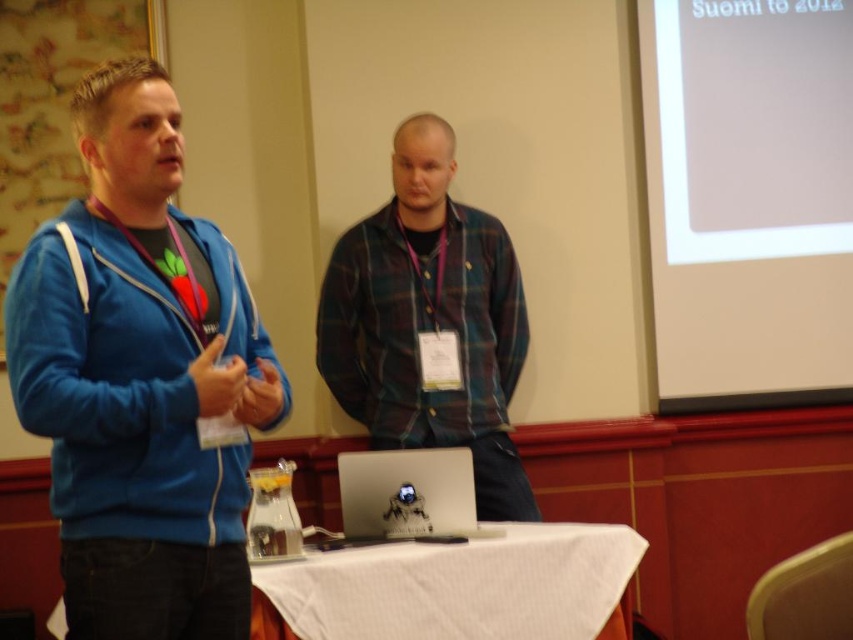
Question: Is plaid fabric shirt at center to the right of white cloth at lower center from the viewer's perspective?

Choices:
 (A) no
 (B) yes

Answer: (A)

Question: Which point is farther to the camera?

Choices:
 (A) white matte projection screen at upper right
 (B) white cloth at lower center
 (C) plaid fabric shirt at center
 (D) blue fleece jacket at left

Answer: (A)

Question: Which of these objects is positioned closest to the white matte projection screen at upper right?

Choices:
 (A) blue fleece jacket at left
 (B) white cloth at lower center
 (C) silver metallic laptop at center
 (D) plaid fabric shirt at center

Answer: (D)

Question: Can you confirm if white matte projection screen at upper right is positioned above plaid fabric shirt at center?

Choices:
 (A) no
 (B) yes

Answer: (B)

Question: Considering the real-world distances, which object is farthest from the white cloth at lower center?

Choices:
 (A) plaid fabric shirt at center
 (B) white matte projection screen at upper right

Answer: (B)

Question: Is plaid fabric shirt at center wider than silver metallic laptop at center?

Choices:
 (A) yes
 (B) no

Answer: (A)